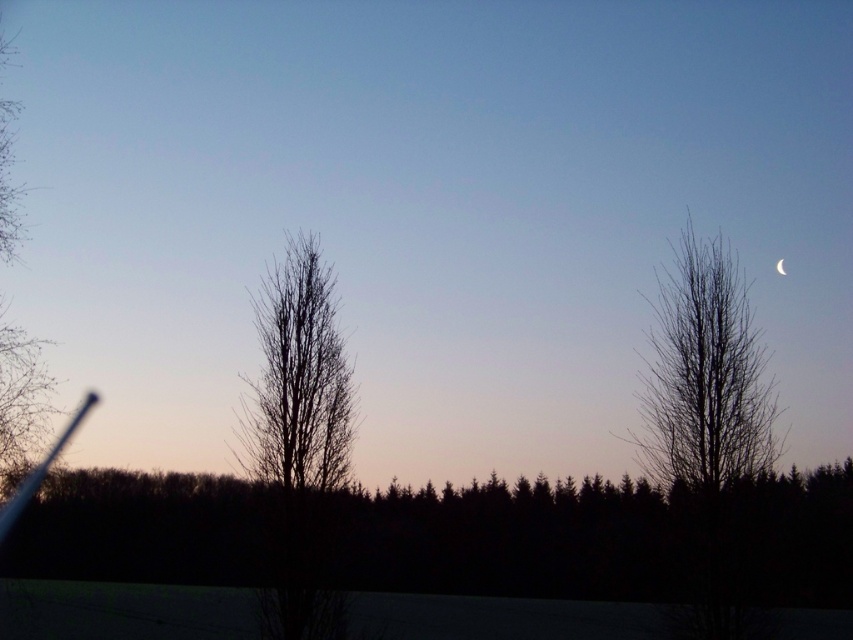
Can you confirm if brown/dry wood tree at center is positioned above silvery metallic crescent at upper center?

Incorrect, brown/dry wood tree at center is not positioned above silvery metallic crescent at upper center.

Describe the element at coordinates (299, 378) in the screenshot. I see `brown/dry wood tree at center` at that location.

Image resolution: width=853 pixels, height=640 pixels. Describe the element at coordinates (299, 378) in the screenshot. I see `brown/dry wood tree at center` at that location.

The image size is (853, 640). Identify the location of brown/dry wood tree at center. (299, 378).

Is silhouette bare tree at left taller than silvery metallic crescent at upper center?

Yes.

Which is below, silhouette bare tree at left or silvery metallic crescent at upper center?

silvery metallic crescent at upper center is lower down.

What do you see at coordinates (20, 401) in the screenshot? I see `silhouette bare tree at left` at bounding box center [20, 401].

Find the location of `silhouette bare tree at left`. silhouette bare tree at left is located at coordinates (20, 401).

Can you confirm if brown/dry wood tree at center is thinner than silhouette bare tree at left?

Yes, brown/dry wood tree at center is thinner than silhouette bare tree at left.

Does point (309, 458) come in front of point (6, 451)?

Yes.

I want to click on brown/dry wood tree at center, so click(299, 378).